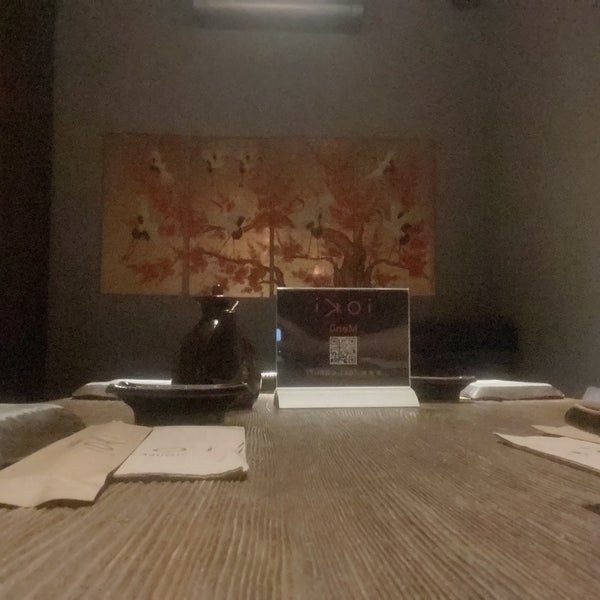
In order to click on empty wall below frame in this screenshot , I will do `click(149, 328)`.